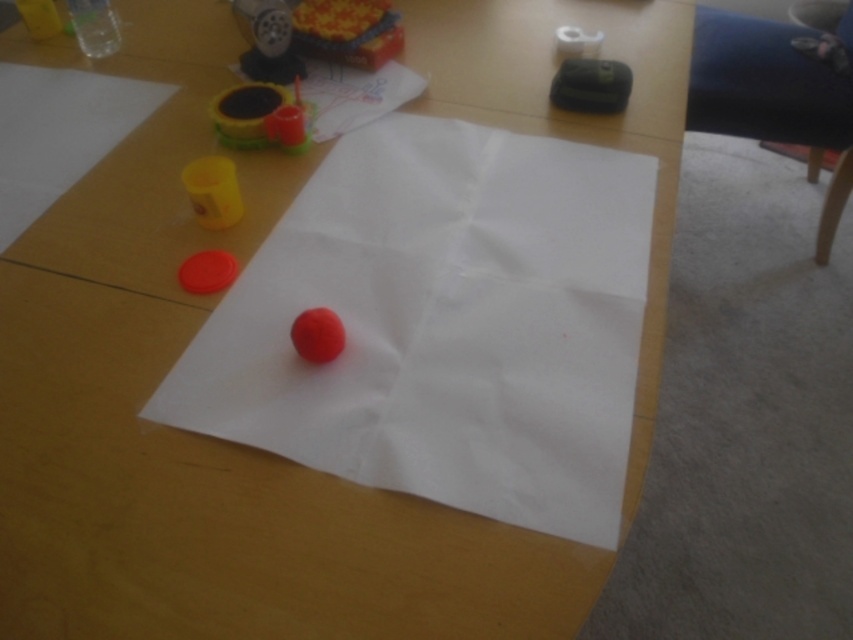
Question: Is rubberized plastic toy at upper center to the left of rubber ball at center from the viewer's perspective?

Choices:
 (A) no
 (B) yes

Answer: (B)

Question: Which is nearer to the rubber ball at center?

Choices:
 (A) white matte toilet paper at upper center
 (B) yellow plastic cup at upper left

Answer: (B)

Question: Is yellow plastic cup at upper left above rubber ball at center?

Choices:
 (A) no
 (B) yes

Answer: (B)

Question: Which of the following is the closest to the observer?

Choices:
 (A) (251, 61)
 (B) (210, 278)
 (C) (308, 317)

Answer: (C)

Question: From the image, what is the correct spatial relationship of yellow plastic cup at upper left in relation to white matte toilet paper at upper center?

Choices:
 (A) above
 (B) below

Answer: (B)

Question: Which of the following is the farthest from the observer?

Choices:
 (A) (334, 326)
 (B) (578, 45)
 (C) (193, 257)

Answer: (B)